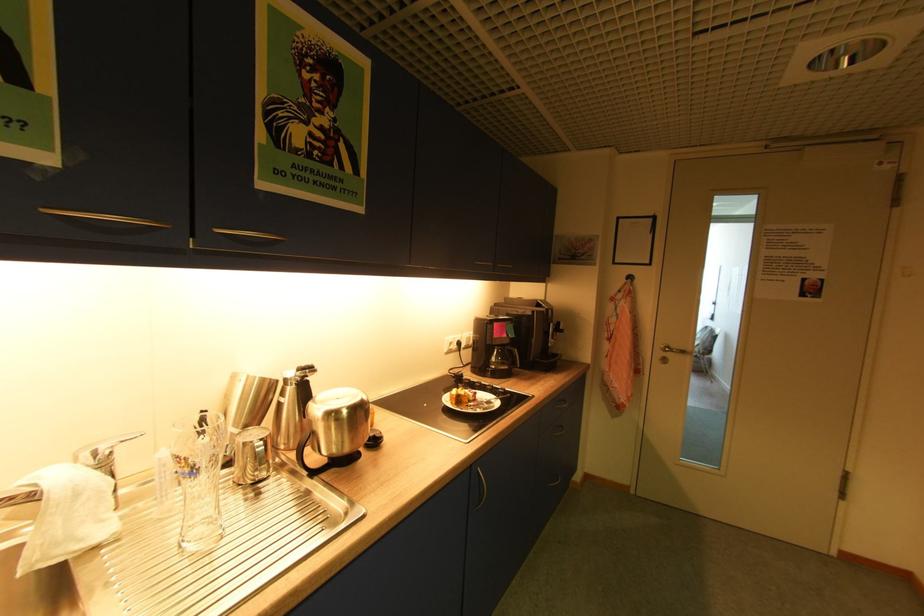
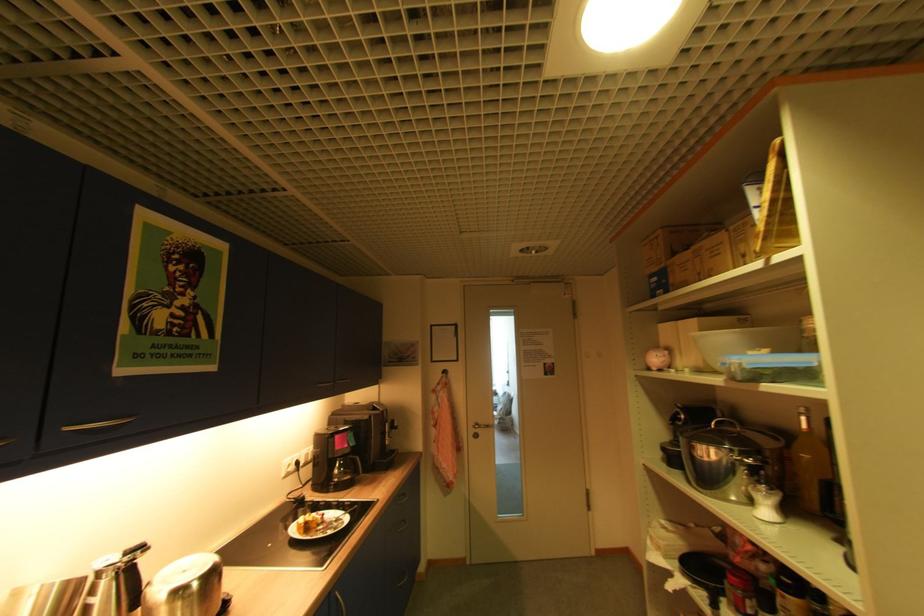
In the second image, find the point that corresponds to pixel 502 325 in the first image.

(343, 437)